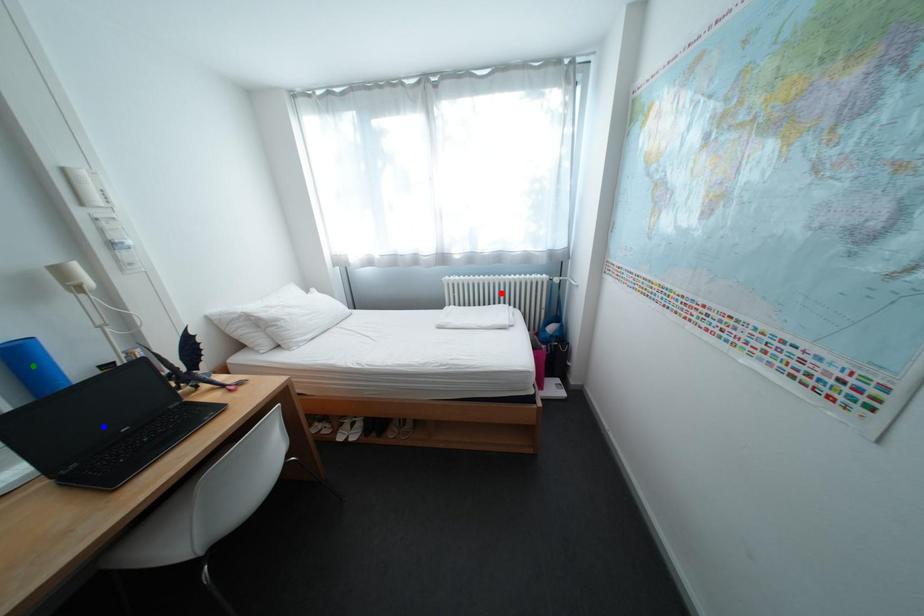
Order these from nearest to farthest:
blue point | green point | red point

red point < green point < blue point